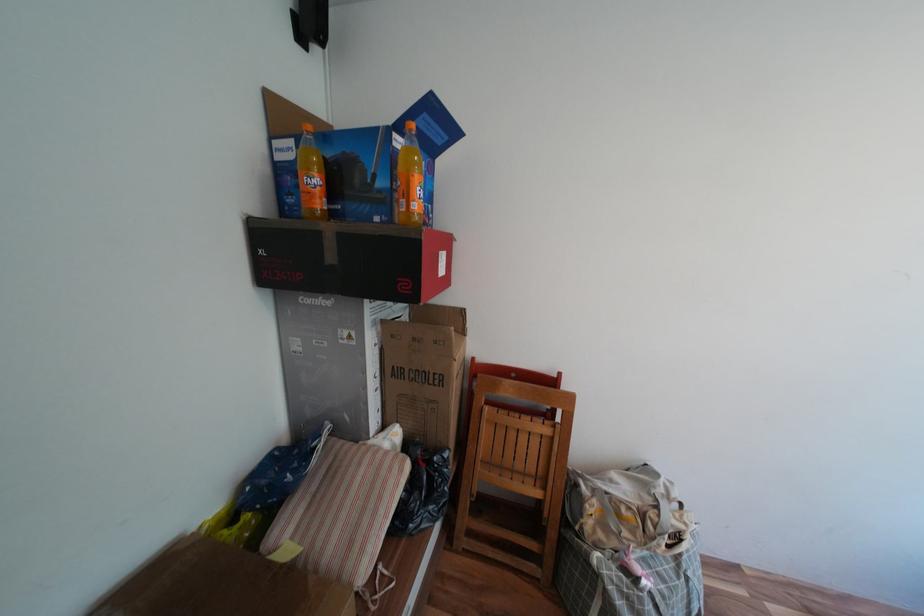
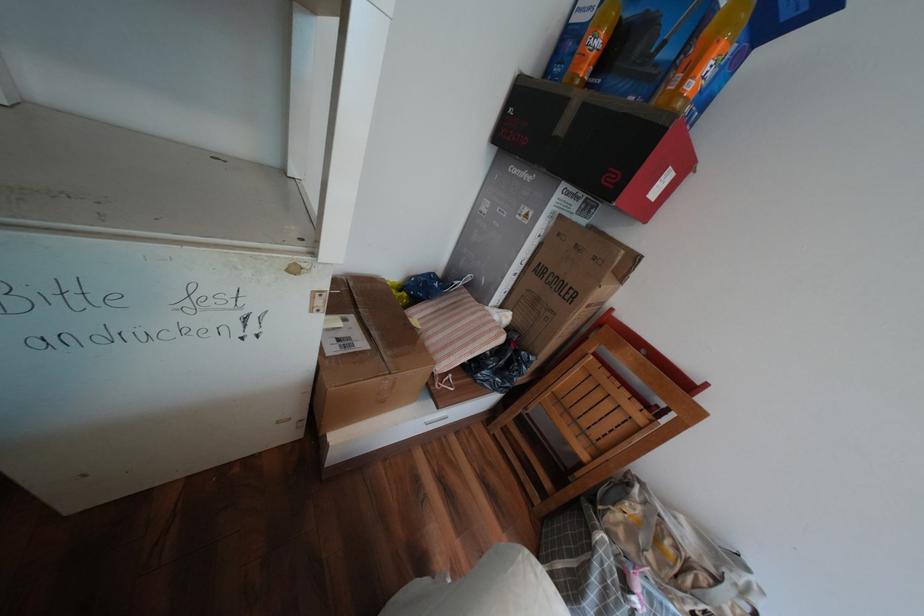
First-person continuous shooting, in which direction is the camera rotating?

Result: The camera rotated toward left-down.